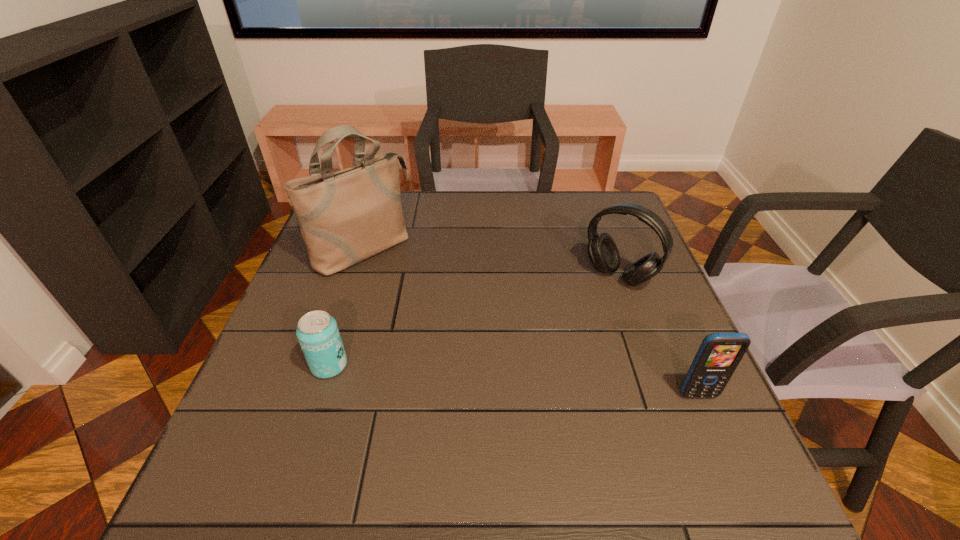
Identify the location of free spot on the desktop that is between the beer can and the nearest object and is positioned on the front-facing side of the shoulder bag. (521, 381).

Find the location of a particular element. This screenshot has width=960, height=540. vacant space on the desktop that is between the shortest object and the nearest object and is positioned on the earcups of the headset is located at coordinates pyautogui.click(x=531, y=382).